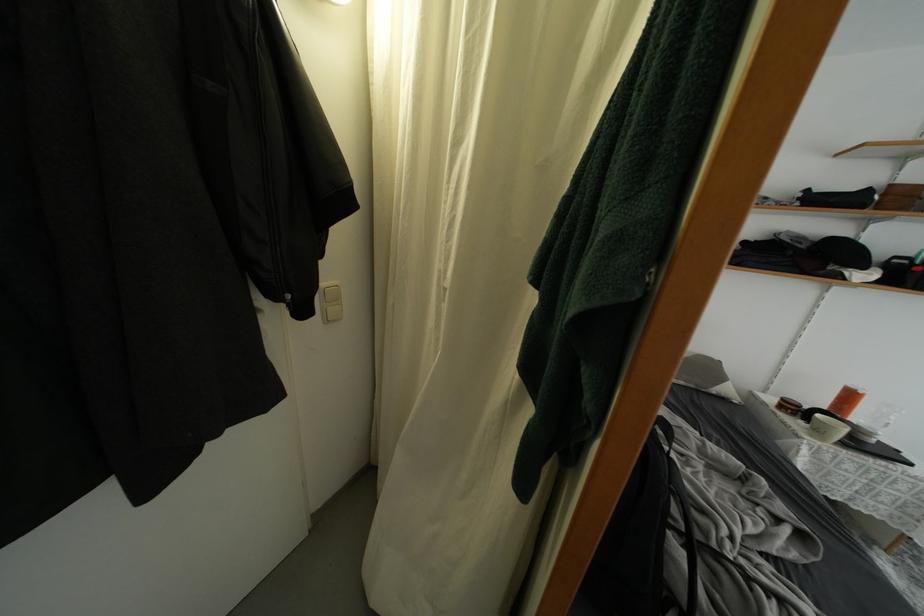
Where would you pull the jacket zipper pull? Please return your answer as a coordinate pair (x, y).

(263, 146)